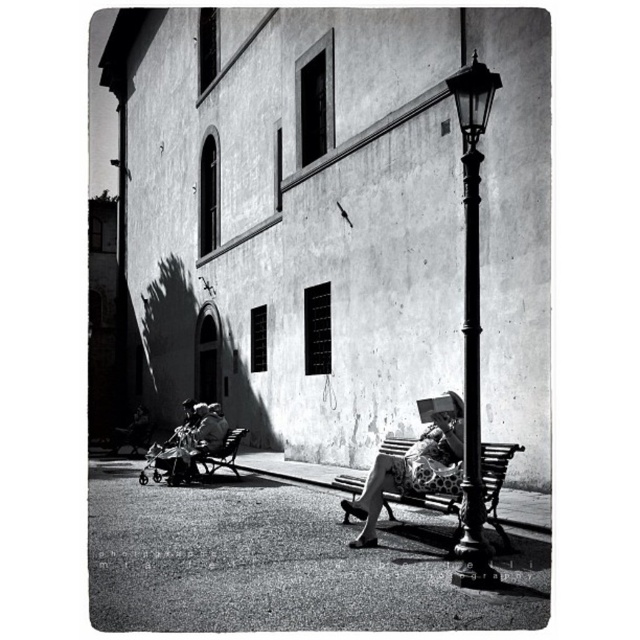
Consider the image. You are standing at the center of the image. Which direction should you look to see the polished metal streetlamp at right?

The polished metal streetlamp at right is located at the right side of the image, so you should look to your right to see it.

You are a photographer trying to capture the scene with a wide angle lens. The polka dot dress at center and the smooth fabric stroller at lower left are both in your frame. Which object would appear bigger in your photo?

The polka dot dress at center would appear bigger in the photo because it has a larger size compared to the smooth fabric stroller at lower left.

You are standing in the street scene and want to take a photo of both the woman reading and the streetlamp. Which point, point (468, 387) or point (205, 426), is closer to your camera position?

Point (468, 387) is closer to the camera than point (205, 426).